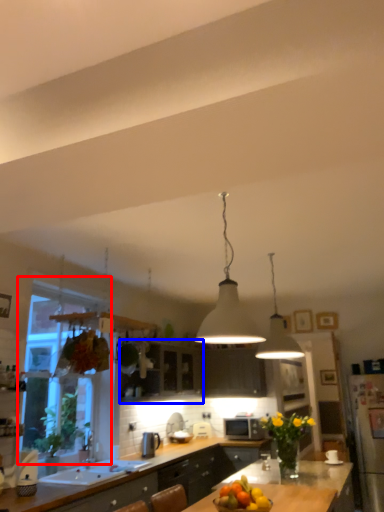
Question: Which point is further to the camera, window (highlighted by a red box) or cabinetry (highlighted by a blue box)?

Choices:
 (A) window
 (B) cabinetry

Answer: (B)